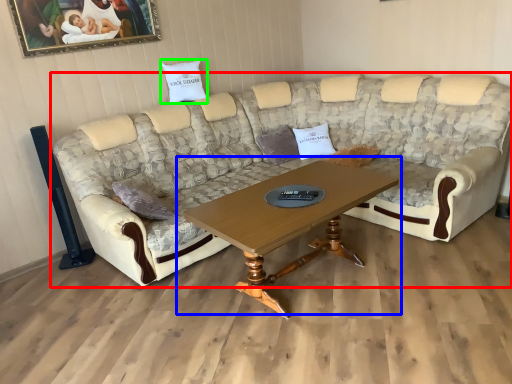
Question: Based on their relative distances, which object is farther from studio couch (highlighted by a red box)? Choose from coffee table (highlighted by a blue box) and pillow (highlighted by a green box).

Choices:
 (A) coffee table
 (B) pillow

Answer: (B)